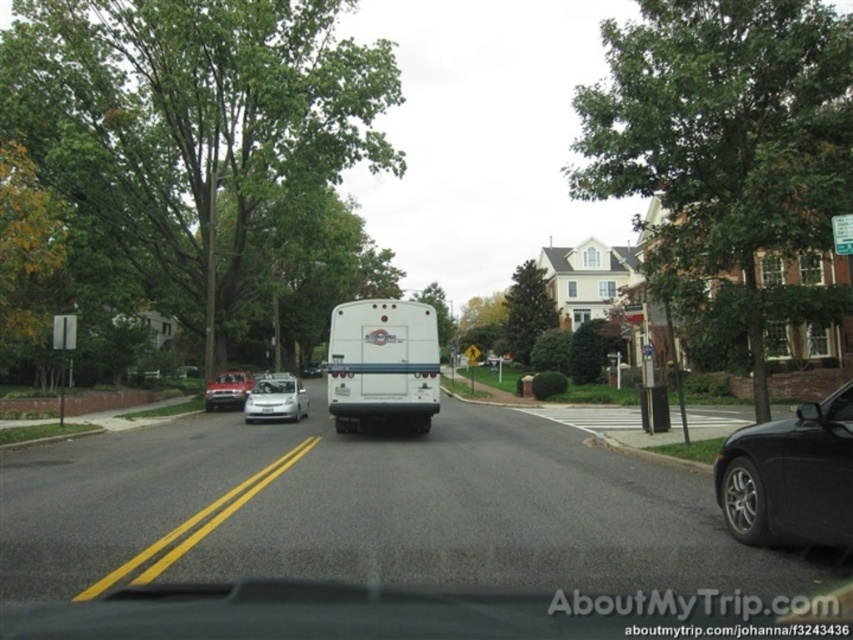
Can you confirm if white matte ambulance at center is taller than green leafy tree at center?

No, white matte ambulance at center is not taller than green leafy tree at center.

Which is more to the left, white matte ambulance at center or green leafy tree at center?

white matte ambulance at center is more to the left.

Does point (410, 422) come in front of point (440, 346)?

That is True.

Locate an element on the screen. This screenshot has height=640, width=853. white matte ambulance at center is located at coordinates (381, 364).

This screenshot has width=853, height=640. Identify the location of green textured tree at center. (527, 310).

Between green textured tree at center and green leafy tree at center, which one appears on the right side from the viewer's perspective?

green textured tree at center

Who is more forward, (520, 264) or (419, 296)?

Point (419, 296) is more forward.

Where is `green textured tree at center`? green textured tree at center is located at coordinates pos(527,310).

Can you confirm if white matte ambulance at center is positioned above green textured tree at center?

No, white matte ambulance at center is not above green textured tree at center.

What do you see at coordinates (381, 364) in the screenshot?
I see `white matte ambulance at center` at bounding box center [381, 364].

Between point (357, 422) and point (531, 294), which one is positioned in front?

Point (357, 422) is in front.

The height and width of the screenshot is (640, 853). I want to click on white matte ambulance at center, so (x=381, y=364).